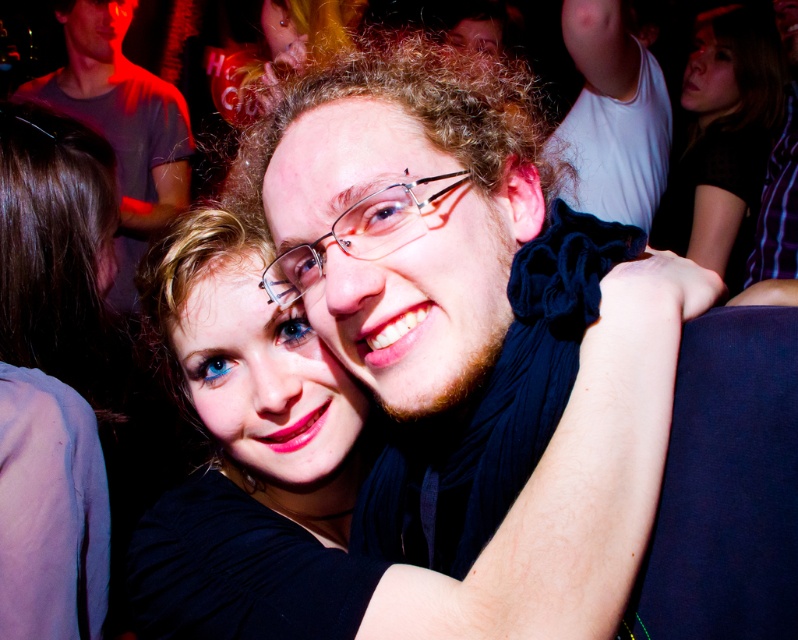
Question: Estimate the real-world distances between objects in this image. Which object is farther from the smooth pink shirt at left?

Choices:
 (A) gray cotton t-shirt at upper left
 (B) clear plastic glasses at center
 (C) black fabric at upper right

Answer: (C)

Question: Does matte black scarf at center appear on the right side of clear plastic glasses at center?

Choices:
 (A) yes
 (B) no

Answer: (A)

Question: Is gray cotton t-shirt at upper left to the left of clear plastic glasses at center from the viewer's perspective?

Choices:
 (A) yes
 (B) no

Answer: (A)

Question: Which point is farther to the camera?

Choices:
 (A) (105, 106)
 (B) (301, 244)

Answer: (A)

Question: Which object appears closest to the camera in this image?

Choices:
 (A) matte black scarf at center
 (B) clear plastic glasses at center

Answer: (A)

Question: Is matte black scarf at center behind black fabric at upper right?

Choices:
 (A) yes
 (B) no

Answer: (B)